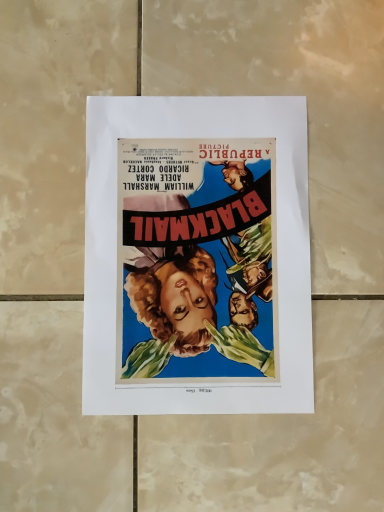
Identify the location of free location above vivid paper poster at center (from a real-world perspective). The height and width of the screenshot is (512, 384). (205, 244).